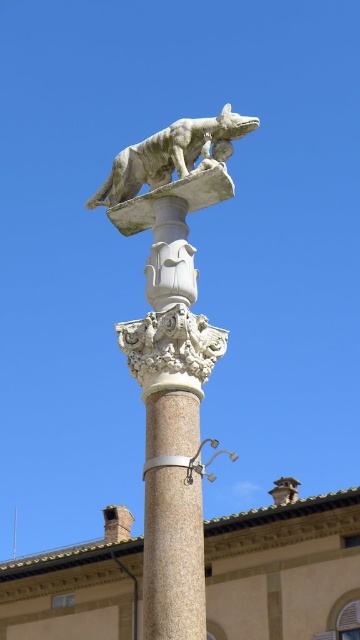
Looking at this image, you are an architect designing a new plaza and want to place both the white marble wolf at upper center and the metallic silver lamp post at center. Given their sizes, which one should be placed higher to maintain visual balance?

The white marble wolf at upper center is much taller than the metallic silver lamp post at center, so to maintain visual balance, the metallic silver lamp post at center should be placed higher to compensate for its smaller size.

From the picture: You are a city planner assessing the layout of a public square. You notice the white marble wolf at upper center and the metallic silver lamp post at center. Given that the minimum safety distance between such statues and lamp posts is 30 feet, is the current placement compliant with safety regulations?

The white marble wolf at upper center is 27.27 feet away from the metallic silver lamp post at center. Since the required minimum safety distance is 30 feet, the current placement is not compliant with safety regulations.